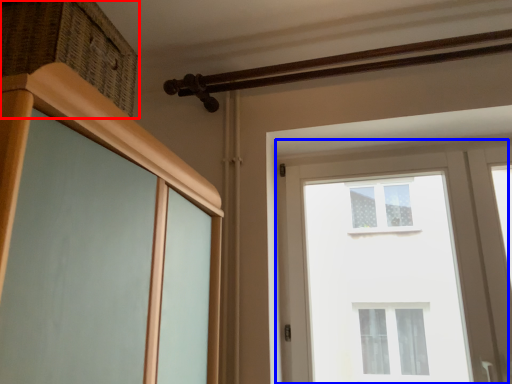
Question: Which of the following is the closest to the observer, drawer (highlighted by a red box) or window (highlighted by a blue box)?

Choices:
 (A) drawer
 (B) window

Answer: (A)